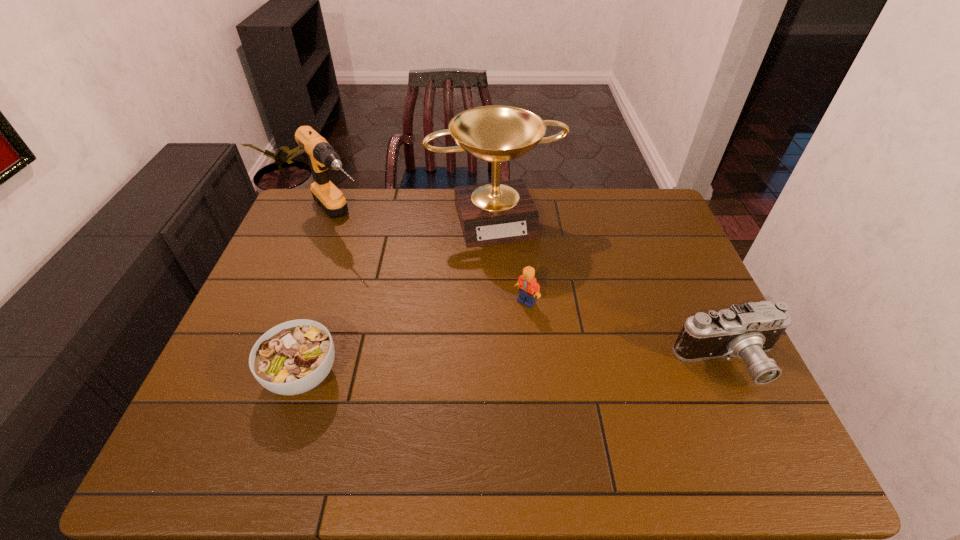
What are the coordinates of `soup bowl` in the screenshot? It's located at (293, 357).

Where is `the rightmost object`? the rightmost object is located at coordinates (747, 331).

I want to click on award, so click(x=492, y=213).

This screenshot has height=540, width=960. Identify the location of drill. (322, 156).

Where is `the third nearest object`? The height and width of the screenshot is (540, 960). the third nearest object is located at coordinates (528, 287).

Find the location of a particular element. This screenshot has width=960, height=540. vacant space situated on the right of the soup bowl is located at coordinates [x=420, y=375].

At what (x,y) coordinates should I click in order to perform the action: click on free location located at the lens of the camera. Please return your answer as a coordinate pair (x, y). This screenshot has width=960, height=540. Looking at the image, I should click on (754, 416).

Where is `vacant area situated on the front-facing side of the award`? vacant area situated on the front-facing side of the award is located at coordinates (517, 267).

The width and height of the screenshot is (960, 540). What are the coordinates of `vacant space located on the front-facing side of the award` in the screenshot? It's located at (522, 281).

Where is `free space located on the front-facing side of the award`? free space located on the front-facing side of the award is located at coordinates (534, 312).